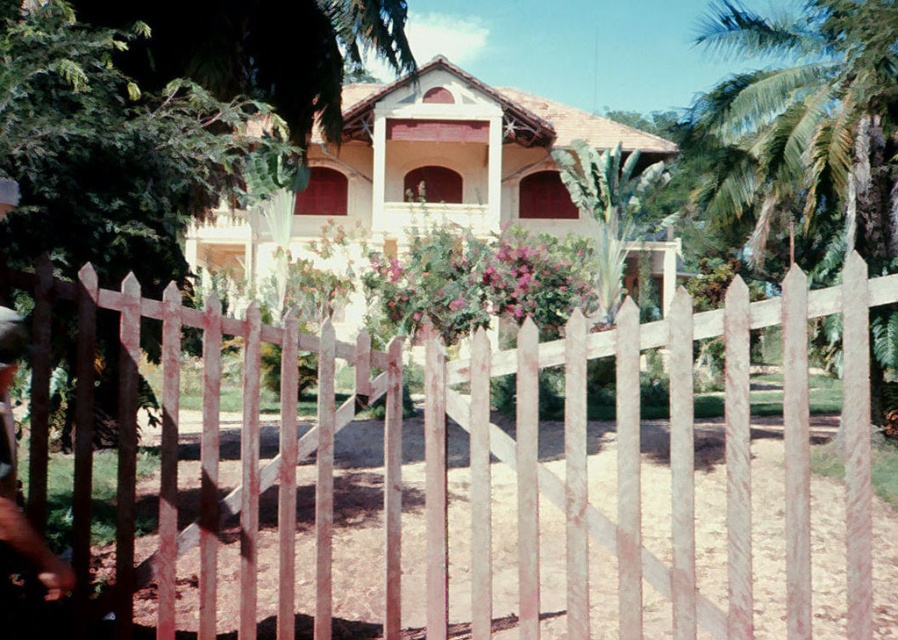
Question: From the image, what is the correct spatial relationship of white wooden picket fence at center in relation to green leafy palm tree at center?

Choices:
 (A) left
 (B) right

Answer: (A)

Question: Is white wooden picket fence at center below green leafy palm tree at center?

Choices:
 (A) no
 (B) yes

Answer: (B)

Question: Does white wooden picket fence at center have a lesser width compared to green leafy palm tree at center?

Choices:
 (A) no
 (B) yes

Answer: (A)

Question: Which of the following is the farthest from the observer?

Choices:
 (A) green leafy palm tree at center
 (B) white wooden picket fence at center

Answer: (A)

Question: Which of the following is the farthest from the observer?

Choices:
 (A) (635, 230)
 (B) (438, 348)

Answer: (A)

Question: Which object is farther from the camera taking this photo?

Choices:
 (A) white wooden picket fence at center
 (B) green leafy palm tree at center

Answer: (B)